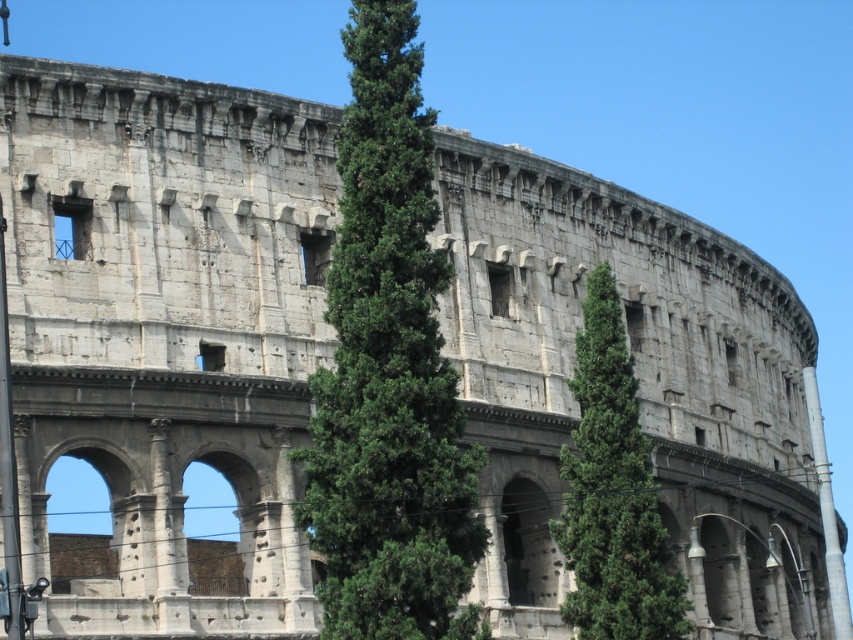
Is green leafy tree at center smaller than green textured tree at center?

Incorrect, green leafy tree at center is not smaller in size than green textured tree at center.

Can you confirm if green leafy tree at center is thinner than green textured tree at center?

In fact, green leafy tree at center might be wider than green textured tree at center.

At what (x,y) coordinates should I click in order to perform the action: click on green leafy tree at center. Please return your answer as a coordinate pair (x, y). Image resolution: width=853 pixels, height=640 pixels. Looking at the image, I should click on (389, 369).